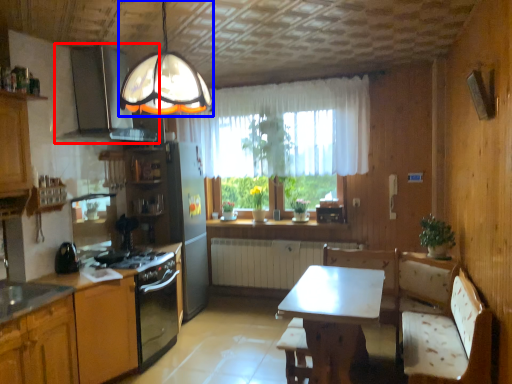
Question: Which point is further to the camera, exhaust hood (highlighted by a red box) or lamp (highlighted by a blue box)?

Choices:
 (A) exhaust hood
 (B) lamp

Answer: (A)